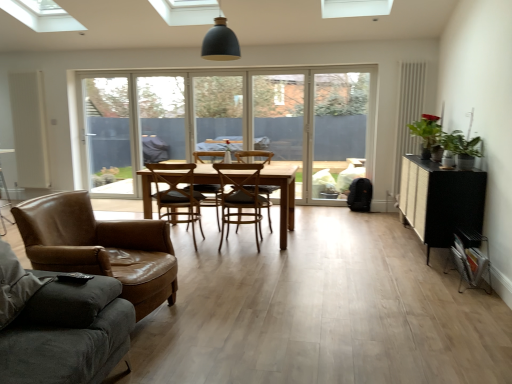
This screenshot has height=384, width=512. I want to click on empty space that is in between black textured cabinet at right and brown leather armchair at left, the first chair positioned from the front, so click(x=315, y=271).